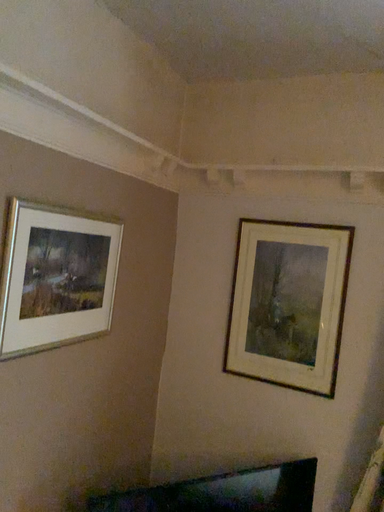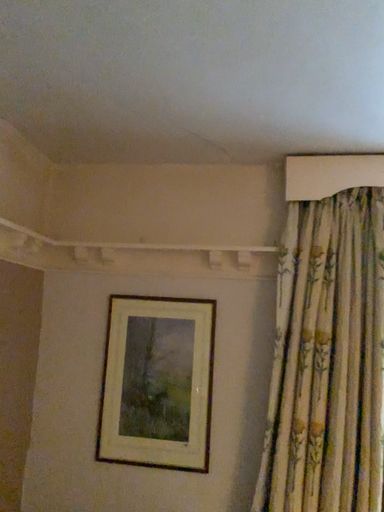
Question: Which way did the camera rotate in the video?

Choices:
 (A) rotated upward
 (B) rotated downward

Answer: (A)